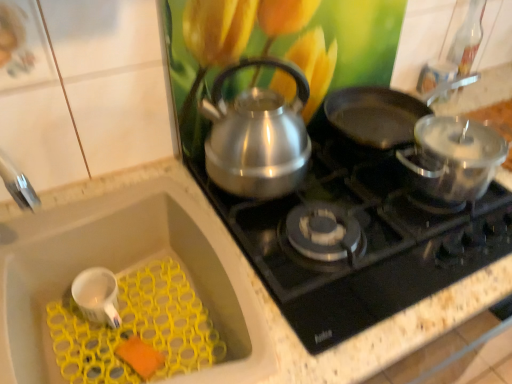
Question: Are shiny black frying pan at upper right and polished stainless steel kettle at upper center beside each other?

Choices:
 (A) no
 (B) yes

Answer: (A)

Question: From a real-world perspective, is shiny black frying pan at upper right located higher than polished stainless steel kettle at upper center?

Choices:
 (A) yes
 (B) no

Answer: (A)

Question: Would you say shiny black frying pan at upper right is outside polished stainless steel kettle at upper center?

Choices:
 (A) no
 (B) yes

Answer: (B)

Question: Is shiny black frying pan at upper right closer to the viewer compared to polished stainless steel kettle at upper center?

Choices:
 (A) yes
 (B) no

Answer: (B)

Question: Is shiny black frying pan at upper right surrounding polished stainless steel kettle at upper center?

Choices:
 (A) no
 (B) yes

Answer: (A)

Question: Would you say polished stainless steel kettle at upper center is inside or outside white matte sink at lower left?

Choices:
 (A) inside
 (B) outside

Answer: (B)

Question: Is polished stainless steel kettle at upper center taller or shorter than white matte sink at lower left?

Choices:
 (A) short
 (B) tall

Answer: (A)

Question: Visually, is polished stainless steel kettle at upper center positioned to the left or to the right of white matte sink at lower left?

Choices:
 (A) left
 (B) right

Answer: (B)

Question: From a real-world perspective, is polished stainless steel kettle at upper center positioned above or below white matte sink at lower left?

Choices:
 (A) below
 (B) above

Answer: (B)

Question: Considering the positions of point (237, 311) and point (313, 145), is point (237, 311) closer or farther from the camera than point (313, 145)?

Choices:
 (A) closer
 (B) farther

Answer: (A)

Question: Is white matte sink at lower left spatially inside polished stainless steel kettle at upper center, or outside of it?

Choices:
 (A) inside
 (B) outside

Answer: (B)

Question: Looking at the image, does white matte sink at lower left seem bigger or smaller compared to polished stainless steel kettle at upper center?

Choices:
 (A) big
 (B) small

Answer: (A)

Question: From the image's perspective, is white matte sink at lower left located above or below polished stainless steel kettle at upper center?

Choices:
 (A) below
 (B) above

Answer: (A)

Question: From a real-world perspective, is white matte sink at lower left positioned above or below white matte mug at lower left?

Choices:
 (A) above
 (B) below

Answer: (B)

Question: Does point (141, 190) appear closer or farther from the camera than point (117, 288)?

Choices:
 (A) closer
 (B) farther

Answer: (B)